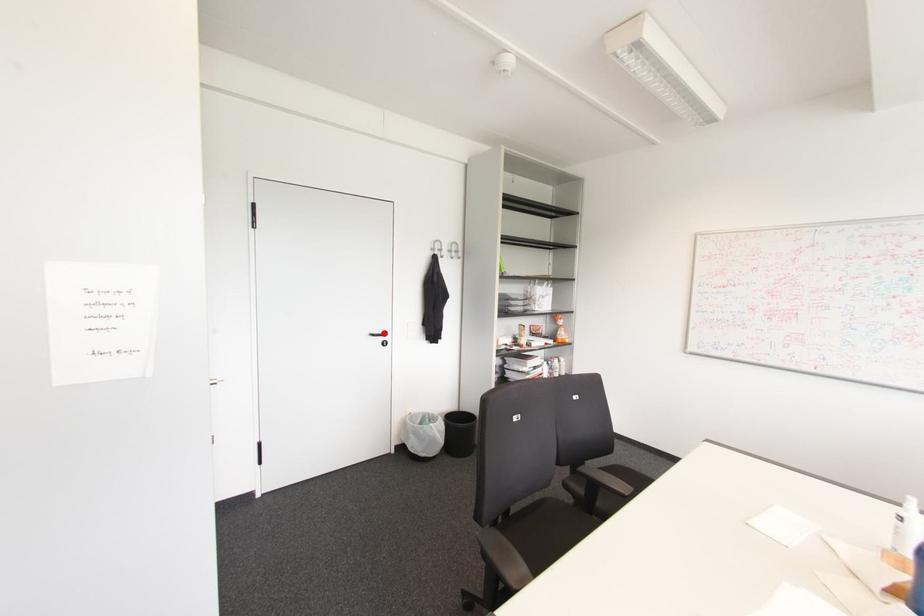
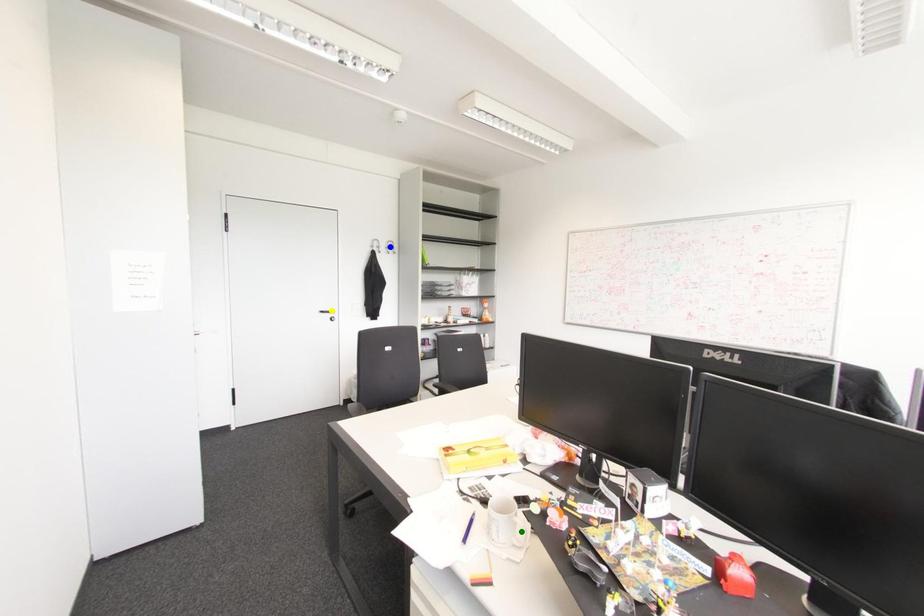
Question: I am providing you with two images of the same scene from different viewpoints. A red point is marked on the first image. You are given multiple points on the second image. Which point in image 2 represents the same 3d spot as the red point in image 1?

Choices:
 (A) green point
 (B) blue point
 (C) yellow point

Answer: (C)